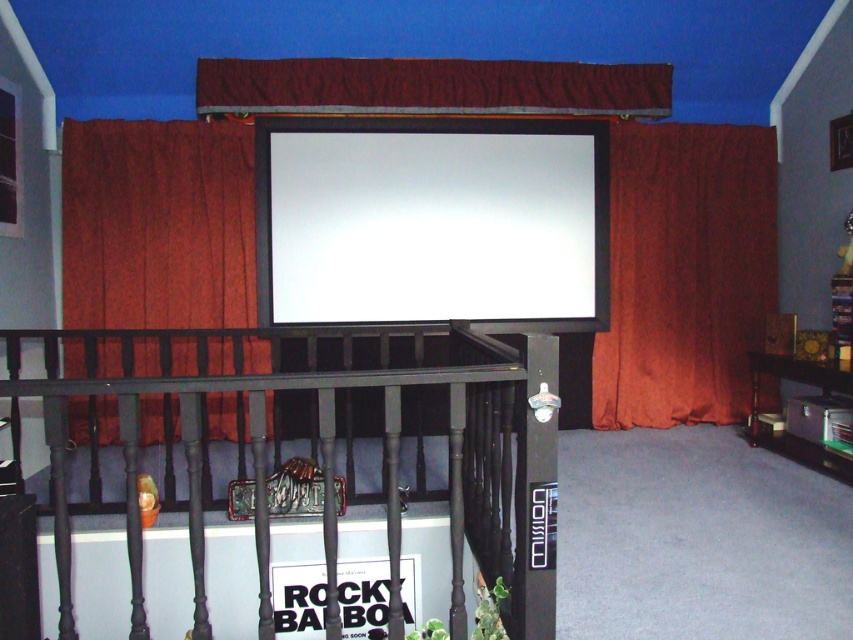
You are a guest at a movie night and want to know which burgundy velvet curtain is closer to you. The options are the burgundy velvet curtain at right and the velvet burgundy curtain at upper center. Which one is closer?

The burgundy velvet curtain at right is closer to you because it is further to the viewer than the velvet burgundy curtain at upper center.

From the picture: You are planning to hang a new artwork on the wall behind the white glossy projection screen at upper center and the crimson velvet curtain at left. Considering their sizes, which object would require a larger wall space for installation?

The crimson velvet curtain at left requires a larger wall space for installation because the white glossy projection screen at upper center occupies less space than it.

You are standing in the home theater and want to reach the crimson velvet curtain at left. Given that you can walk 10 feet in one minute, how long will it take you to reach the curtain?

Answer: The distance between you and the crimson velvet curtain at left is 15.58 feet. Since you can walk 10 feet in one minute, it will take approximately 1.56 minutes to reach the curtain.